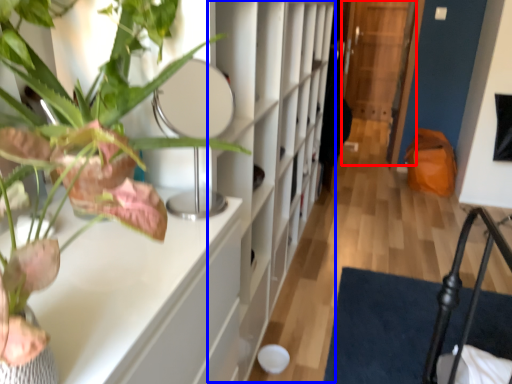
Question: Which object is further to the camera taking this photo, glass door (highlighted by a red box) or bookshelf (highlighted by a blue box)?

Choices:
 (A) glass door
 (B) bookshelf

Answer: (A)